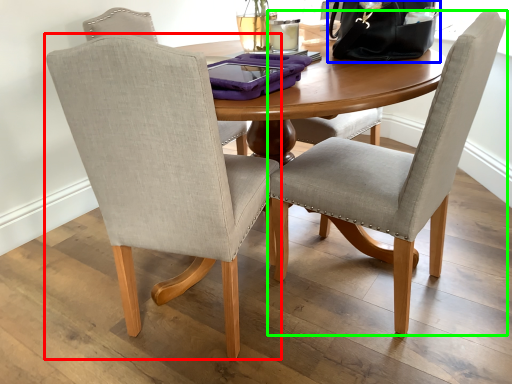
Question: Considering the real-world distances, which object is closest to chair (highlighted by a red box)? handbag (highlighted by a blue box) or chair (highlighted by a green box).

Choices:
 (A) handbag
 (B) chair

Answer: (B)